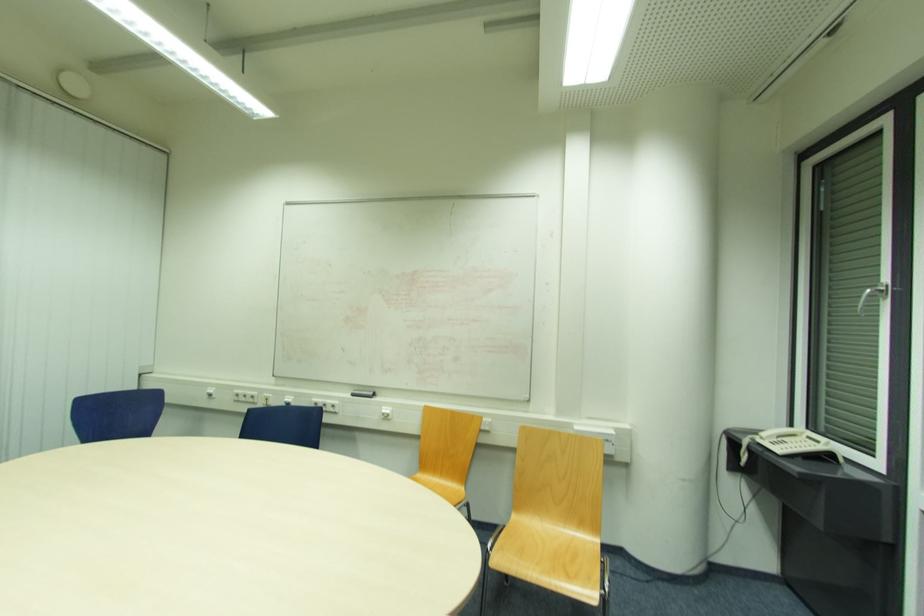
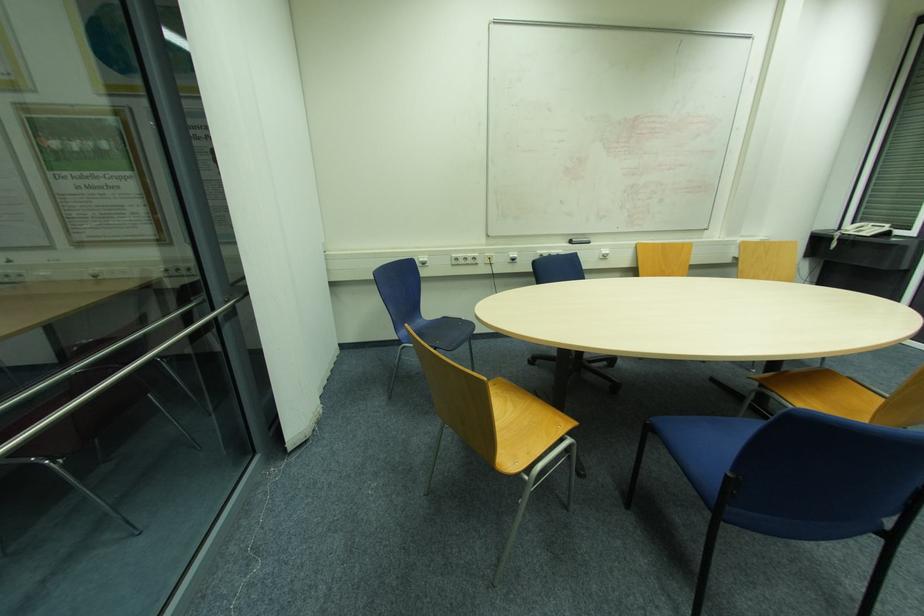
Find the pixel in the second image that matches the point at 779,450 in the first image.

(869, 233)